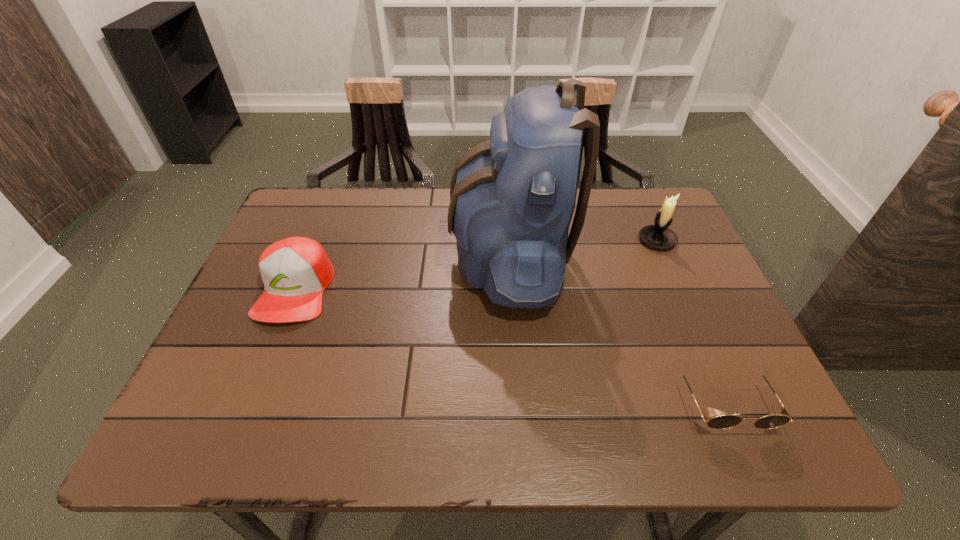
Locate an element on the screen. the tallest object is located at coordinates (512, 198).

Find the location of `backpack`. backpack is located at coordinates (512, 198).

Where is `candle holder`? candle holder is located at coordinates (659, 236).

Locate an element on the screen. The height and width of the screenshot is (540, 960). the leftmost object is located at coordinates (295, 271).

Locate an element on the screen. Image resolution: width=960 pixels, height=540 pixels. the second shortest object is located at coordinates (295, 271).

You are a GUI agent. You are given a task and a screenshot of the screen. Output one action in this format:
    pyautogui.click(x=<x>, y=<y>)
    Task: Click on the shortest object
    The image size is (960, 540).
    Given the screenshot: What is the action you would take?
    pyautogui.click(x=782, y=417)

You are a GUI agent. You are given a task and a screenshot of the screen. Output one action in this format:
    pyautogui.click(x=<x>, y=<y>)
    Task: Click on the nearest object
    Image resolution: width=960 pixels, height=540 pixels.
    Given the screenshot: What is the action you would take?
    pyautogui.click(x=782, y=417)

The width and height of the screenshot is (960, 540). I want to click on free space located at the front pocket of the tallest object, so click(342, 256).

Find the location of a particular element. This screenshot has height=540, width=960. free space located at the front pocket of the tallest object is located at coordinates (392, 256).

Where is `vacant space located at the front pocket of the tallest object`? Image resolution: width=960 pixels, height=540 pixels. vacant space located at the front pocket of the tallest object is located at coordinates (300, 256).